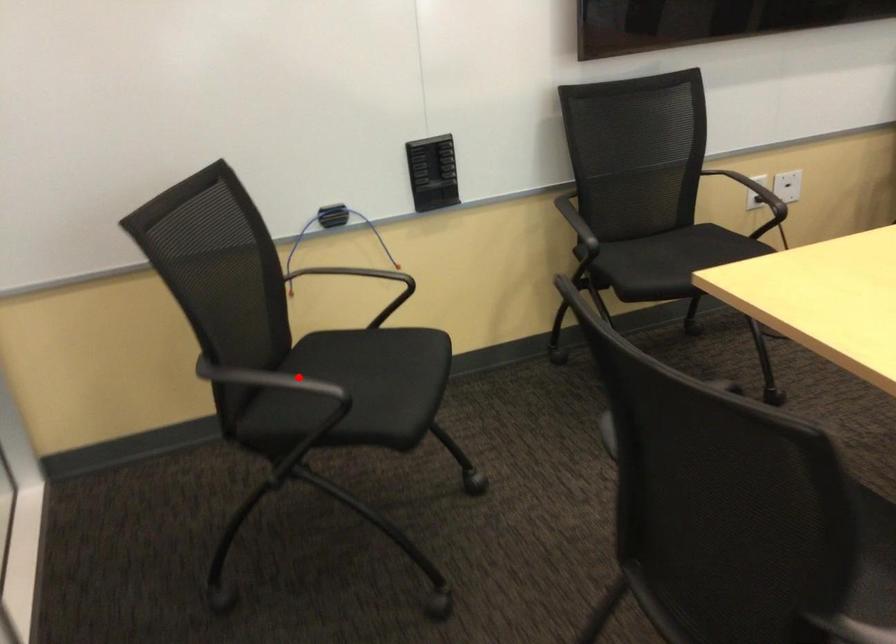
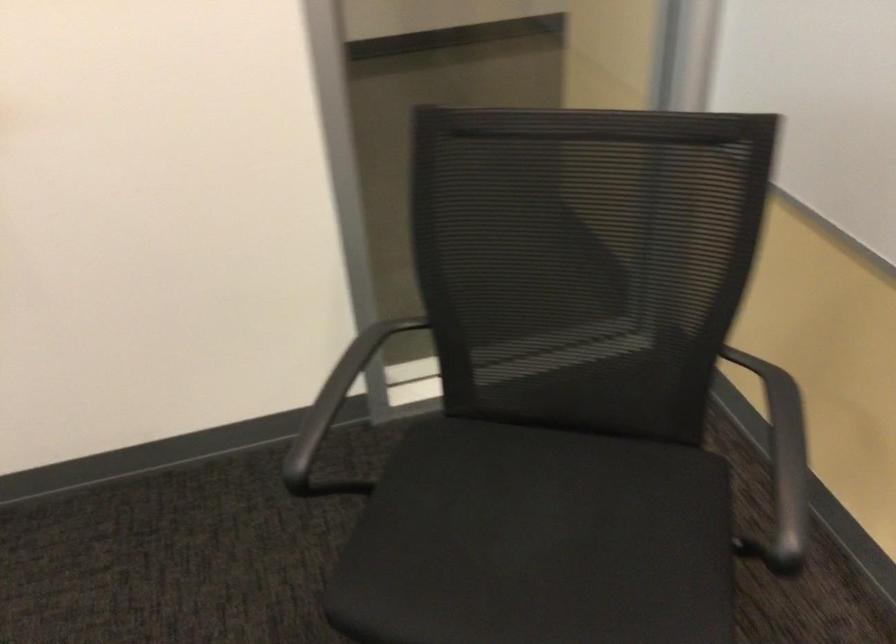
In the second image, find the point that corresponds to the highlighted location in the first image.

(330, 415)